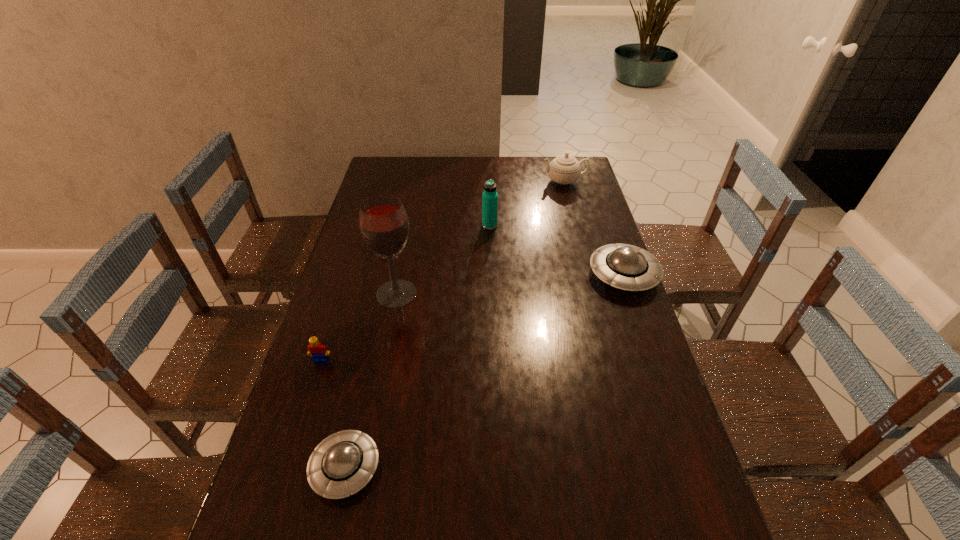
Where is `object that is the third closest to the tallest object`? object that is the third closest to the tallest object is located at coordinates (342, 464).

The width and height of the screenshot is (960, 540). In order to click on object that can be found as the fifth closest to the nearer saucer in this screenshot , I will do click(564, 169).